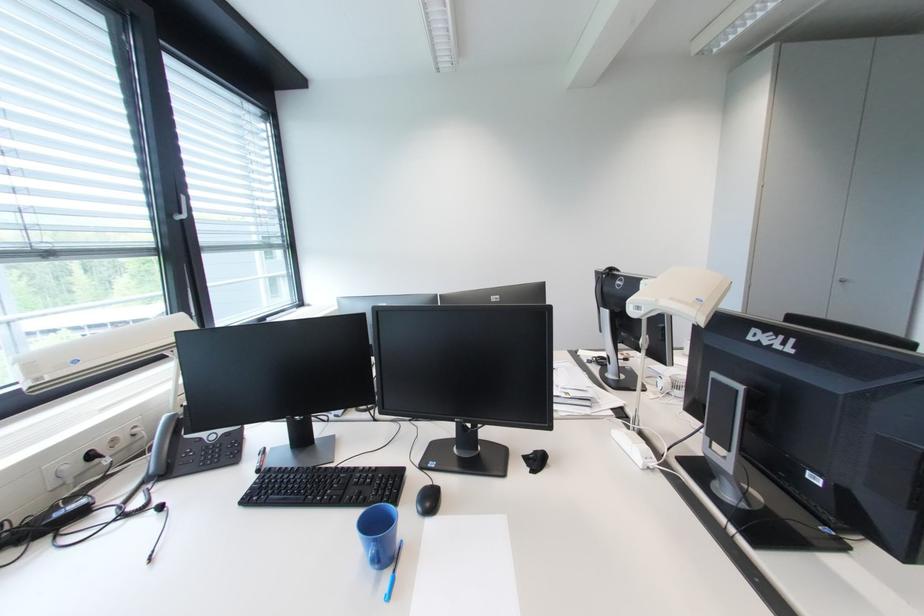
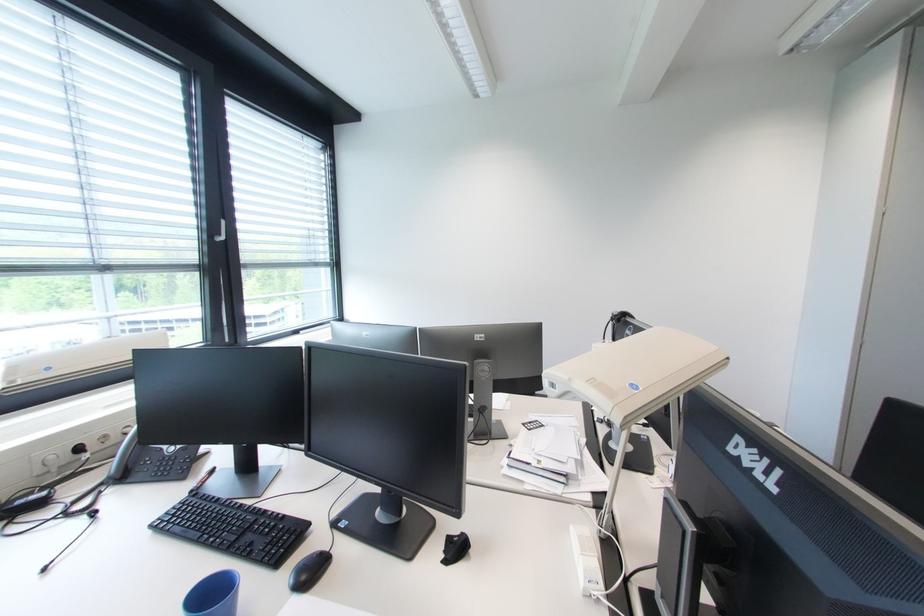
In the second image, find the point that corresponds to (663,302) in the first image.

(577, 381)